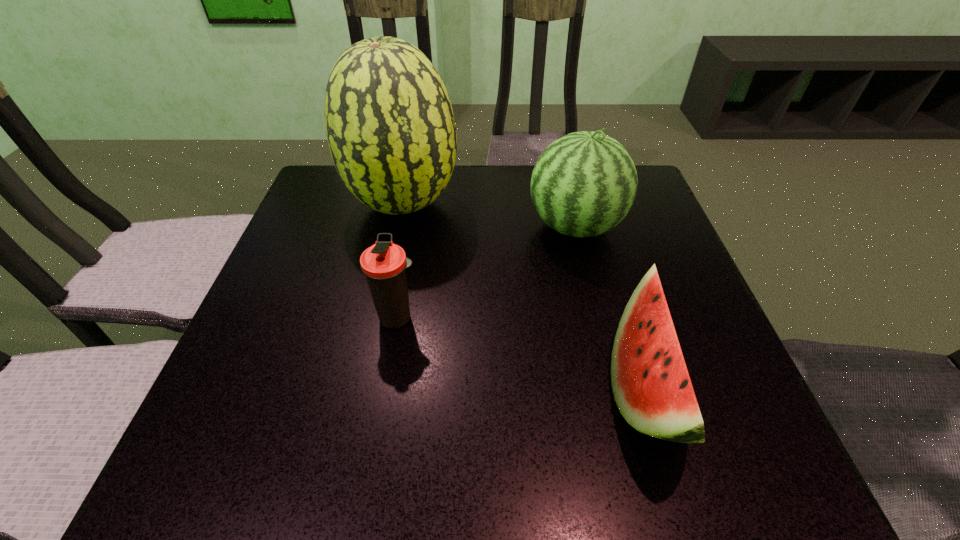
Find the location of a particular element. This screenshot has width=960, height=540. free spot located on the outer rind of the nearest watermelon is located at coordinates (393, 386).

The height and width of the screenshot is (540, 960). Identify the location of object at the near edge. (651, 385).

You are a GUI agent. You are given a task and a screenshot of the screen. Output one action in this format:
    pyautogui.click(x=<x>, y=<y>)
    Task: Click on the object positioned at the left edge
    Image resolution: width=960 pixels, height=540 pixels.
    Given the screenshot: What is the action you would take?
    pos(390,127)

Image resolution: width=960 pixels, height=540 pixels. I want to click on object located in the far left corner section of the desktop, so click(390, 127).

Where is `object present at the far right corner`? Image resolution: width=960 pixels, height=540 pixels. object present at the far right corner is located at coordinates (583, 184).

Locate an element on the screen. Image resolution: width=960 pixels, height=540 pixels. object that is at the near right corner is located at coordinates (651, 385).

In the image, there is a desktop. At what (x,y) coordinates should I click in order to perform the action: click on vacant space at the far edge. Please return your answer as a coordinate pair (x, y). This screenshot has width=960, height=540. Looking at the image, I should click on (483, 205).

The height and width of the screenshot is (540, 960). In order to click on free space at the near edge of the desktop in this screenshot , I will do `click(328, 450)`.

In the image, there is a desktop. Identify the location of vacant region at the left edge. pos(327,263).

Locate an element on the screen. This screenshot has width=960, height=540. vacant area at the right edge is located at coordinates (624, 220).